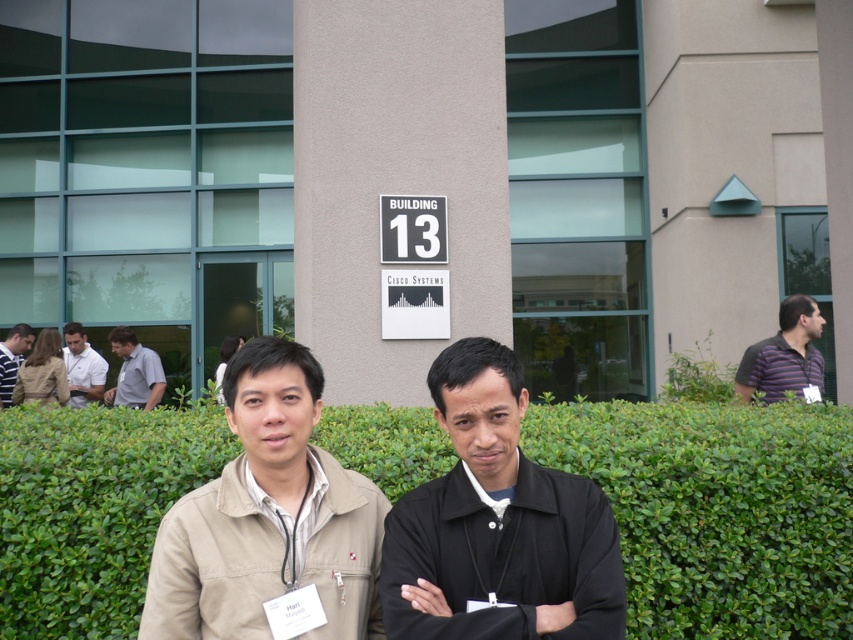
Question: Among these objects, which one is nearest to the camera?

Choices:
 (A) black matte jacket at center
 (B) light gray shirt at left
 (C) light brown leather jacket at left
 (D) striped cotton shirt at right

Answer: (A)

Question: Can you confirm if light brown shirt at left is smaller than light gray shirt at left?

Choices:
 (A) no
 (B) yes

Answer: (A)

Question: Where is light brown shirt at left located in relation to white shirt at left in the image?

Choices:
 (A) right
 (B) left

Answer: (A)

Question: Does black matte jacket at center come behind light brown shirt at left?

Choices:
 (A) yes
 (B) no

Answer: (B)

Question: Which of the following is the farthest from the observer?

Choices:
 (A) striped cotton shirt at right
 (B) green leafy hedge at center
 (C) beige fabric jacket at center

Answer: (A)

Question: Which object appears closest to the camera in this image?

Choices:
 (A) black matte jacket at center
 (B) green leafy hedge at center

Answer: (A)